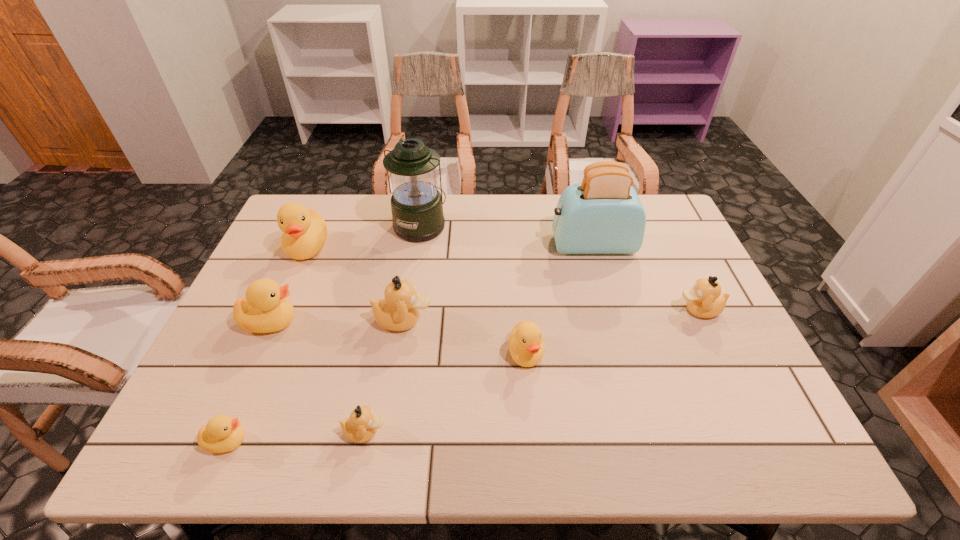
Find the location of `object present at the far left corner`. object present at the far left corner is located at coordinates (304, 230).

Image resolution: width=960 pixels, height=540 pixels. Find the location of `object that is at the near left corner`. object that is at the near left corner is located at coordinates (222, 433).

Find the location of a particular element. Image resolution: width=960 pixels, height=540 pixels. blank space at the far edge is located at coordinates (383, 234).

Identify the location of free region at the left edge of the desktop. This screenshot has height=540, width=960. (276, 336).

The image size is (960, 540). In the image, there is a desktop. In order to click on free region at the right edge in this screenshot , I will do `click(668, 299)`.

You are a GUI agent. You are given a task and a screenshot of the screen. Output one action in this format:
    pyautogui.click(x=<x>, y=<y>)
    Task: Click on the free location at the far left corner
    This screenshot has height=540, width=960.
    Given the screenshot: What is the action you would take?
    pyautogui.click(x=323, y=197)

Identify the location of vacant space at the far right corner of the desktop. This screenshot has height=540, width=960. (658, 218).

The image size is (960, 540). In order to click on empty location between the smallest yellow duckling and the biggest yellow duckling in this screenshot , I will do click(x=267, y=344).

Identify the location of free space that is in between the farthest duckling and the rightmost tan duckling. The height and width of the screenshot is (540, 960). pyautogui.click(x=503, y=279).

Image resolution: width=960 pixels, height=540 pixels. I want to click on empty space that is in between the second smallest tan duckling and the biggest tan duckling, so click(x=551, y=315).